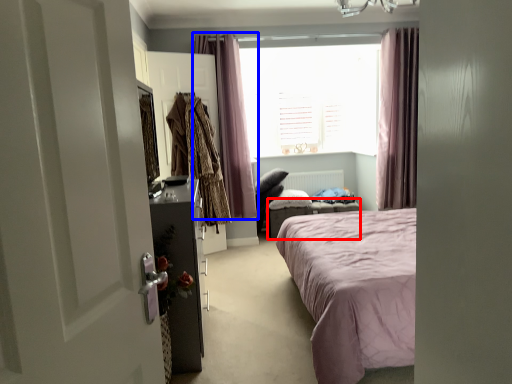
Question: Which point is further to the camera, furniture (highlighted by a red box) or curtain (highlighted by a blue box)?

Choices:
 (A) furniture
 (B) curtain

Answer: (A)